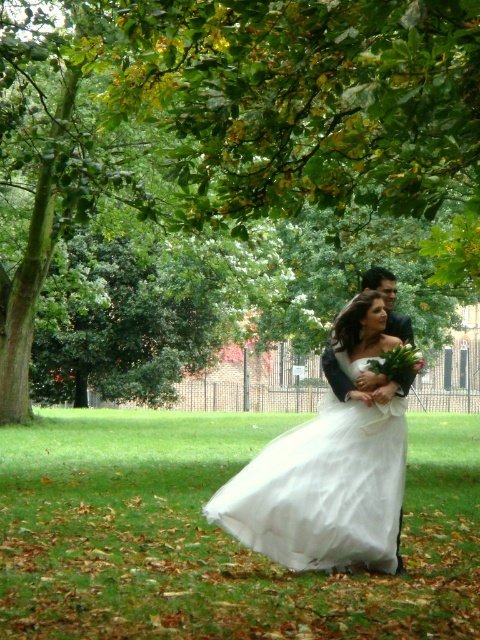
Can you confirm if green leafy tree at upper center is smaller than white tulle dress at center?

Actually, green leafy tree at upper center might be larger than white tulle dress at center.

Can you confirm if green leafy tree at upper center is positioned to the right of white tulle dress at center?

In fact, green leafy tree at upper center is to the left of white tulle dress at center.

The width and height of the screenshot is (480, 640). Identify the location of green leafy tree at upper center. (239, 116).